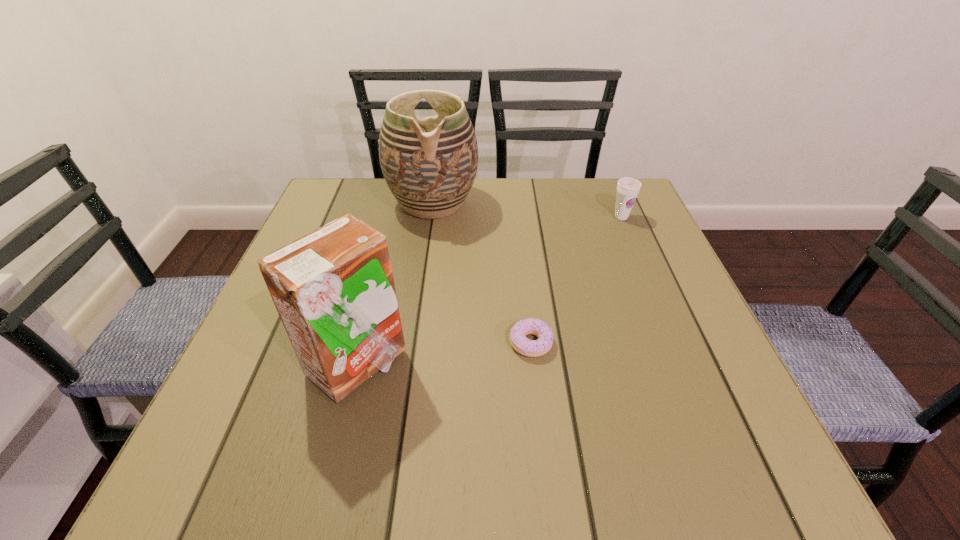
Where is `pottery that is at the far edge`? The width and height of the screenshot is (960, 540). pottery that is at the far edge is located at coordinates (429, 164).

Where is `cup positioned at the far edge`? cup positioned at the far edge is located at coordinates (628, 188).

Find the location of `object at the left edge`. object at the left edge is located at coordinates (333, 288).

At what (x,y) coordinates should I click in order to perform the action: click on object that is at the right edge. Please return your answer as a coordinate pair (x, y). Looking at the image, I should click on (628, 188).

Locate an element on the screen. object that is at the far right corner is located at coordinates (628, 188).

Locate an element on the screen. free space at the far edge of the desktop is located at coordinates (518, 218).

This screenshot has width=960, height=540. Identify the location of free space at the near edge. (652, 489).

Where is `vacant space at the right edge of the desktop`? This screenshot has width=960, height=540. vacant space at the right edge of the desktop is located at coordinates (676, 380).

The height and width of the screenshot is (540, 960). Find the location of `vacant point at the far right corner`. vacant point at the far right corner is located at coordinates (581, 198).

In order to click on vacant space that's between the carton and the second object from right to left in this screenshot , I will do `click(444, 354)`.